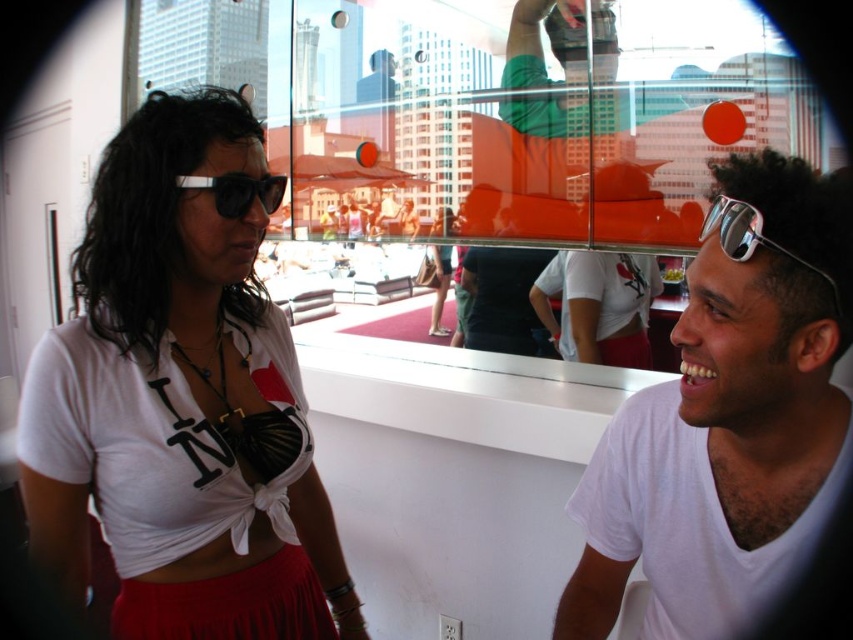
What is the coordinate of the transparent glass window at upper center?

The transparent glass window at upper center is located at coordinate point (479, 122).

You are standing in a room and want to see the outdoor view through the transparent glass window at upper center. However, the white matte shirt at left is blocking your view. Can you move the shirt to the side to get a better view?

The transparent glass window at upper center is taller than the white matte shirt at left, so moving the white matte shirt at left to the side would allow you to see more of the outdoor view through the transparent glass window at upper center.

You are standing in the room and see the point marked at coordinates (181, 403). What object is located at that point?

The point at (181, 403) marks the white matte shirt at left.